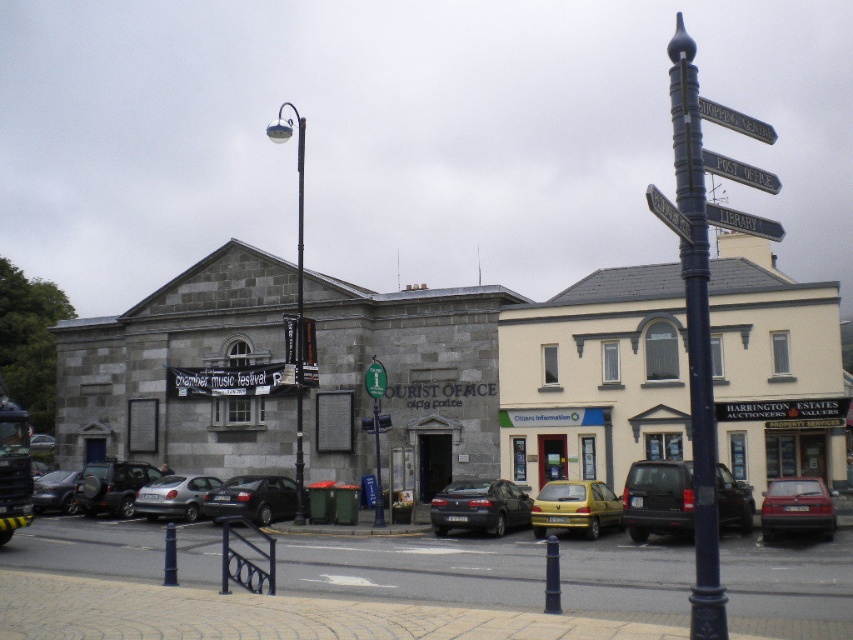
What is located at the coordinates point (x=659, y=499)?

The dark gray matte suv at center is located at point (x=659, y=499).

You are a delivery driver who needs to park your vehicle in the street scene shown. You have a large delivery van that is 5 meters long. The silver metallic hatchback at center and the matte black car at left are parked in the area. Considering their sizes, can your van fit between them without overlapping?

The silver metallic hatchback at center is bigger than the matte black car at left. Since the van is 5 meters long, and the space between the two cars depends on their sizes, but the exact distance isn not provided. However, since the hatchback is larger, the gap might be sufficient. But without precise measurements, it is uncertain. The answer should strictly use the given info. Since the question is about fitting between them based on size comparison, and the hatchback is bigger, the total length of both?